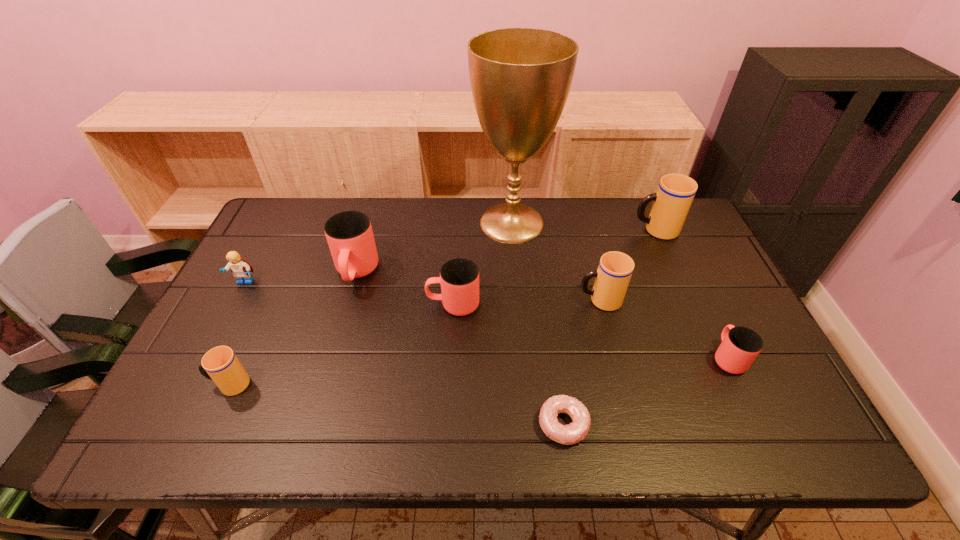
At what (x,y) coordinates should I click in order to perform the action: click on beige cup that is the closest to the leftmost cup. Please return your answer as a coordinate pair (x, y). Looking at the image, I should click on (615, 269).

Point out which pink cup is positioned as the nearest to the rightmost pink cup. Please provide its 2D coordinates. Your answer should be formatted as a tuple, i.e. [(x, y)], where the tuple contains the x and y coordinates of a point satisfying the conditions above.

[(459, 278)]

I want to click on the closest pink cup relative to the trophy cup, so click(459, 278).

Image resolution: width=960 pixels, height=540 pixels. I want to click on vacant area that satisfies the following two spatial constraints: 1. on the side of the second nearest beige cup with the handle; 2. on the front-facing side of the leftmost object, so click(595, 282).

Find the location of a particular element. The width and height of the screenshot is (960, 540). vacant space that satisfies the following two spatial constraints: 1. on the side of the nearest beige cup with the handle; 2. on the handle side of the rightmost pink cup is located at coordinates (242, 357).

Locate an element on the screen. The image size is (960, 540). free location that satisfies the following two spatial constraints: 1. on the side of the second beige cup from left to right with the handle; 2. on the handle side of the biggest pink cup is located at coordinates coord(592,273).

At what (x,y) coordinates should I click in order to perform the action: click on vacant space that satisfies the following two spatial constraints: 1. on the front-facing side of the Lego; 2. on the handle side of the third cup from left to right. Please return your answer as a coordinate pair (x, y). Image resolution: width=960 pixels, height=540 pixels. Looking at the image, I should click on (233, 305).

Find the location of a particular element. The height and width of the screenshot is (540, 960). vacant area in the image that satisfies the following two spatial constraints: 1. on the side of the second biggest beige cup with the handle; 2. on the front-facing side of the leftmost object is located at coordinates (595, 282).